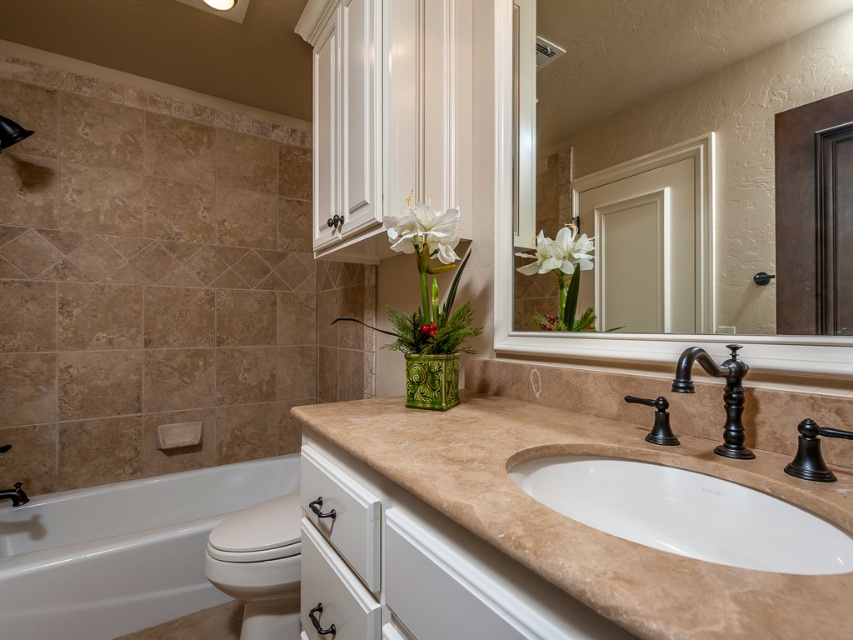
Does beige marble countertop at center have a greater width compared to white glossy toilet at lower left?

Yes.

Does beige marble countertop at center have a larger size compared to white glossy toilet at lower left?

No.

The width and height of the screenshot is (853, 640). Find the location of `beige marble countertop at center`. beige marble countertop at center is located at coordinates (584, 524).

Where is `green glossy vase at center`? This screenshot has width=853, height=640. green glossy vase at center is located at coordinates (431, 380).

Between point (416, 356) and point (572, 266), which one is positioned in front?

Point (416, 356) is in front.

Identify the location of green glossy vase at center. (431, 380).

Who is more forward, (282, 566) or (422, 216)?

Point (422, 216) is more forward.

In the scene shown: Can you confirm if white glossy toilet at lower left is taller than white matte vase at upper center?

Yes.

Which is behind, point (242, 595) or point (456, 234)?

Positioned behind is point (242, 595).

Image resolution: width=853 pixels, height=640 pixels. I want to click on white glossy toilet at lower left, so coord(259,564).